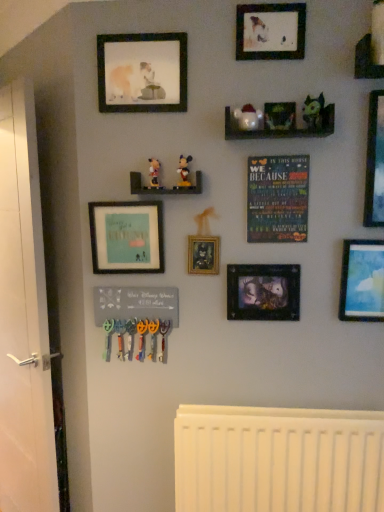
Question: Is wooden shelf at upper right, the third shelf positioned from the bottom, wider or thinner than wooden poster at center?

Choices:
 (A) thin
 (B) wide

Answer: (B)

Question: From the image's perspective, is wooden shelf at upper right, the 1th shelf viewed from the top, above or below wooden poster at center?

Choices:
 (A) above
 (B) below

Answer: (A)

Question: Which object is the farthest from the matte plastic mickey mouse at center, marked as the 1th toy in a left-to-right arrangement?

Choices:
 (A) metallic silver picture frame at center, which is the fourth picture frame in left-to-right order
 (B) wooden shelf at upper right, the 3th shelf when ordered from left to right
 (C) matte blue sky at right, which ranks as the 2th picture frame in right-to-left order
 (D) wooden shelf at upper center, marked as the 2th shelf in a top-to-bottom arrangement
 (E) metallic silver picture frame at upper right, the 1th picture frame positioned from the right

Answer: (C)

Question: Which object is the farthest from the wooden mickey mouse figurines at center, placed as the first shelf when sorted from bottom to top?

Choices:
 (A) matte black picture frame at upper center, acting as the second picture frame starting from the left
 (B) wooden shelf at upper center, which ranks as the second shelf in right-to-left order
 (C) matte black picture frame at upper center, positioned as the 3th picture frame in right-to-left order
 (D) metallic silver picture frame at upper right, which is counted as the 7th picture frame, starting from the left
 (E) matte blue sky at right, which ranks as the sixth picture frame in left-to-right order

Answer: (E)